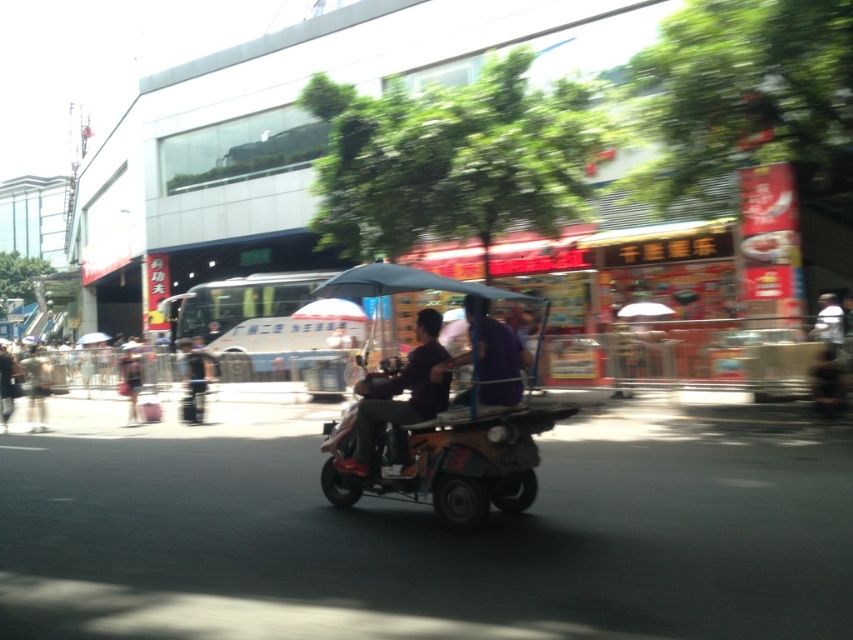
Which is more to the right, purple matte shirt at center or dark gray pants at left?

Positioned to the right is purple matte shirt at center.

Is purple matte shirt at center further to the viewer compared to dark gray pants at left?

That is False.

I want to click on purple matte shirt at center, so click(x=488, y=356).

Is dark purple shirt at center further to camera compared to black fabric suitcase at left?

No, dark purple shirt at center is in front of black fabric suitcase at left.

Is dark purple shirt at center to the left of black fabric suitcase at left from the viewer's perspective?

In fact, dark purple shirt at center is to the right of black fabric suitcase at left.

Find the location of a particular element. dark purple shirt at center is located at coordinates (399, 392).

Locate an element on the screen. dark purple shirt at center is located at coordinates (399, 392).

Can you confirm if dark purple shirt at center is positioned to the left of purple matte shirt at center?

Indeed, dark purple shirt at center is positioned on the left side of purple matte shirt at center.

Which is below, dark purple shirt at center or purple matte shirt at center?

dark purple shirt at center is lower down.

Who is more distant from viewer, (399, 404) or (477, 392)?

Point (399, 404)

Locate an element on the screen. Image resolution: width=853 pixels, height=640 pixels. dark purple shirt at center is located at coordinates (399, 392).